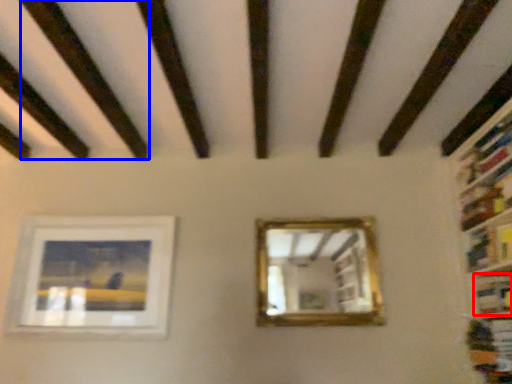
Question: Among these objects, which one is nearest to the camera, book (highlighted by a red box) or plank (highlighted by a blue box)?

Choices:
 (A) book
 (B) plank

Answer: (B)